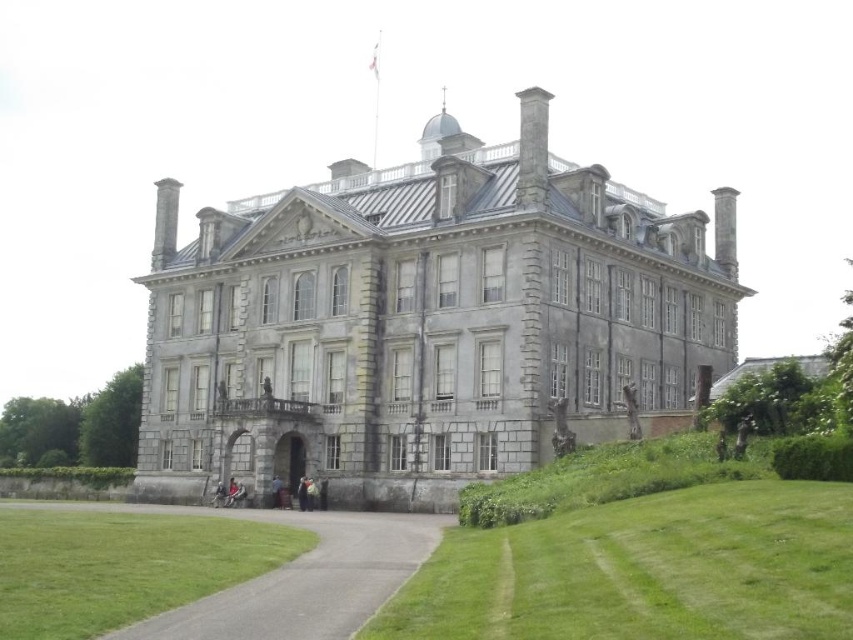
Question: Can you confirm if gray stone mansion at center is positioned to the left of gray asphalt driveway at lower center?

Choices:
 (A) no
 (B) yes

Answer: (A)

Question: Which object appears closest to the camera in this image?

Choices:
 (A) gray asphalt driveway at lower center
 (B) dark blue fabric jacket at center

Answer: (A)

Question: Which object is the farthest from the gray asphalt driveway at lower center?

Choices:
 (A) gray stone mansion at center
 (B) dark blue fabric jacket at center

Answer: (A)

Question: Is gray asphalt driveway at lower center positioned in front of dark blue fabric jacket at center?

Choices:
 (A) yes
 (B) no

Answer: (A)

Question: Which of these objects is positioned closest to the gray asphalt driveway at lower center?

Choices:
 (A) dark blue fabric jacket at center
 (B) gray stone mansion at center

Answer: (A)

Question: Is gray asphalt driveway at lower center to the right of dark blue fabric jacket at center from the viewer's perspective?

Choices:
 (A) no
 (B) yes

Answer: (B)